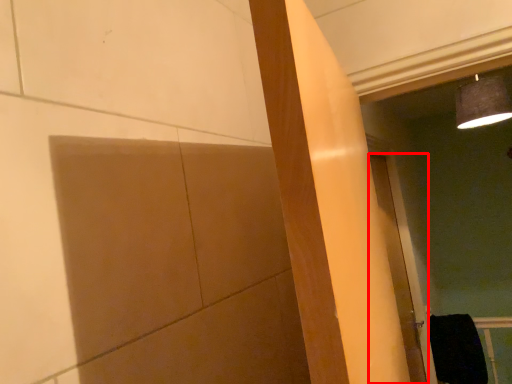
Question: From the image's perspective, what is the correct spatial relationship of door (annotated by the red box) in relation to material?

Choices:
 (A) above
 (B) below

Answer: (A)